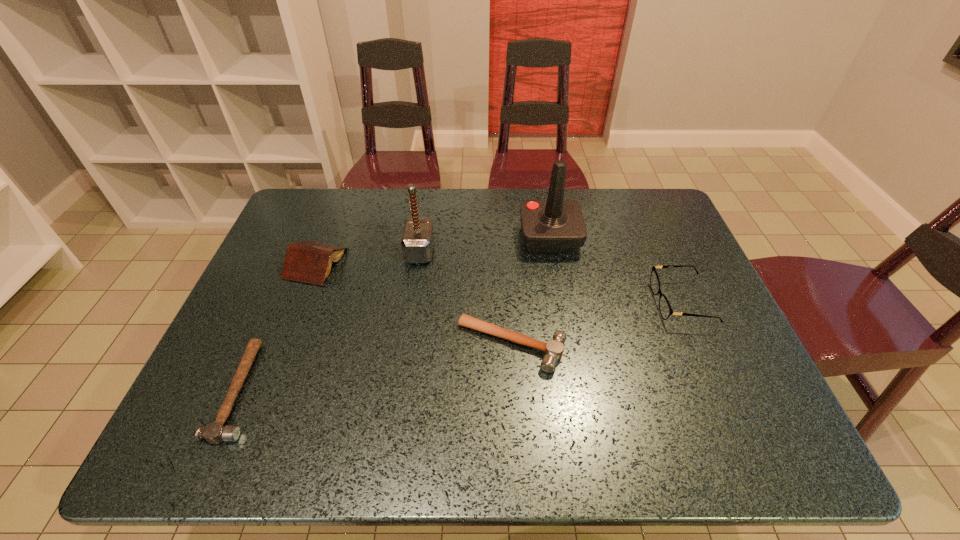
At what (x,y) coordinates should I click in order to perform the action: click on object located at the right edge. Please return your answer as a coordinate pair (x, y). Looking at the image, I should click on (665, 309).

At what (x,y) coordinates should I click in order to perform the action: click on object at the near left corner. Please return your answer as a coordinate pair (x, y). The width and height of the screenshot is (960, 540). Looking at the image, I should click on (214, 433).

The width and height of the screenshot is (960, 540). I want to click on vacant space at the far edge, so click(491, 193).

Locate an element on the screen. The width and height of the screenshot is (960, 540). vacant region at the near edge of the desktop is located at coordinates (422, 419).

The image size is (960, 540). I want to click on vacant region at the left edge of the desktop, so click(283, 307).

Where is `vacant space at the right edge of the desktop`? vacant space at the right edge of the desktop is located at coordinates (705, 321).

Identify the location of free space at the far right corner. The width and height of the screenshot is (960, 540). (612, 190).

At what (x,y) coordinates should I click in order to perform the action: click on free point between the book and the spectacles. Please return your answer as a coordinate pair (x, y). The width and height of the screenshot is (960, 540). Looking at the image, I should click on (499, 282).

This screenshot has width=960, height=540. Find the location of `vacant space that is in between the shortest object and the book`. vacant space that is in between the shortest object and the book is located at coordinates (277, 327).

The image size is (960, 540). What are the coordinates of `free space that is in between the spectacles and the shortest hammer` in the screenshot? It's located at (461, 346).